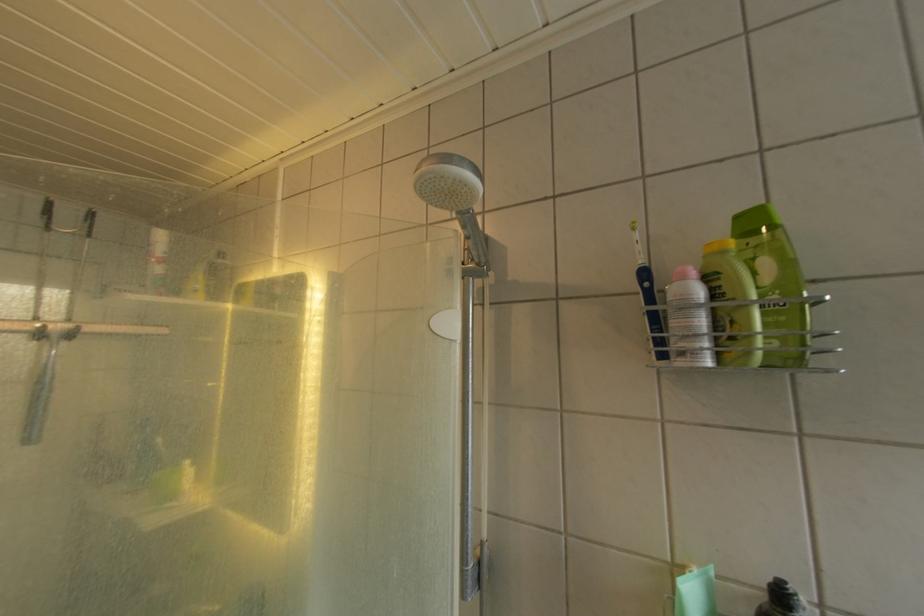
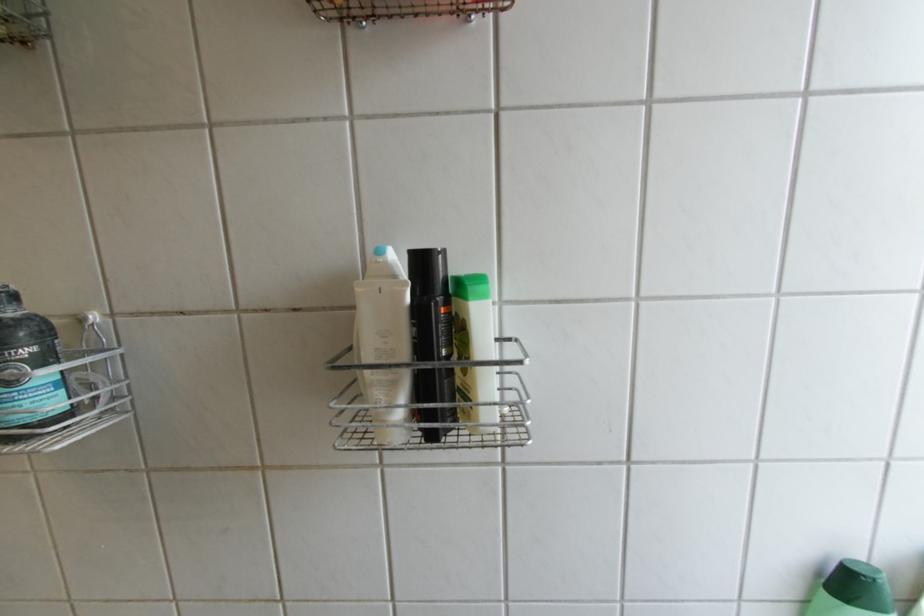
From the picture: The images are taken continuously from a first-person perspective. In which direction is your viewpoint rotating?

The rotation direction of the camera is right-down.